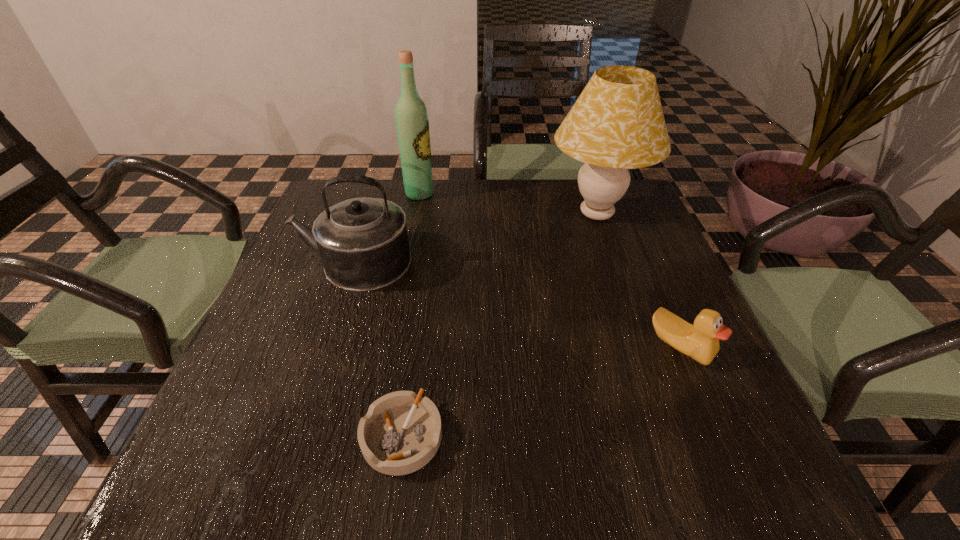
This screenshot has height=540, width=960. In order to click on free location that satisfies the following two spatial constraints: 1. on the back side of the shortest object; 2. on the front-facing side of the wine bottle in this screenshot , I will do `click(436, 194)`.

The width and height of the screenshot is (960, 540). I want to click on free space that satisfies the following two spatial constraints: 1. with the spout at the front of the ashtray; 2. on the right side of the kettle, so click(x=298, y=436).